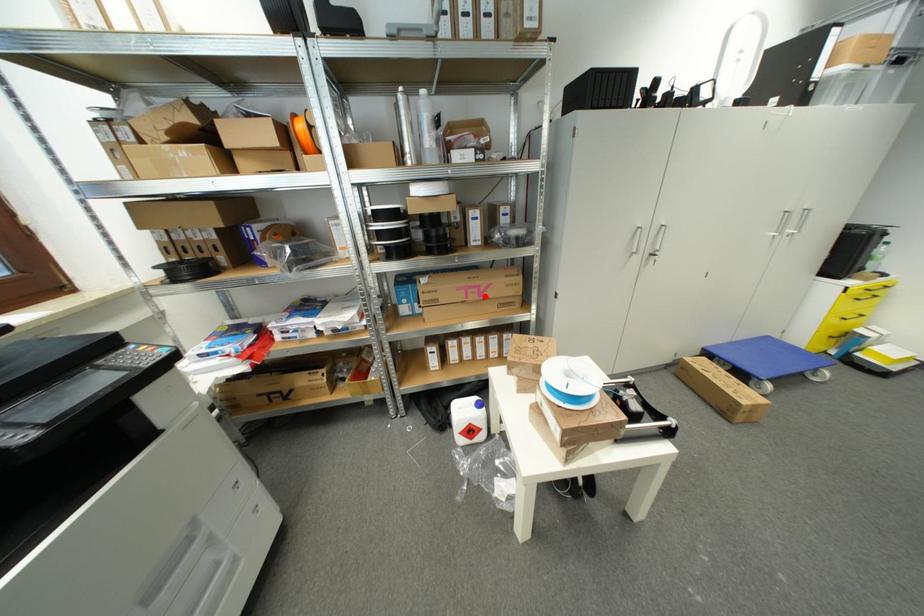
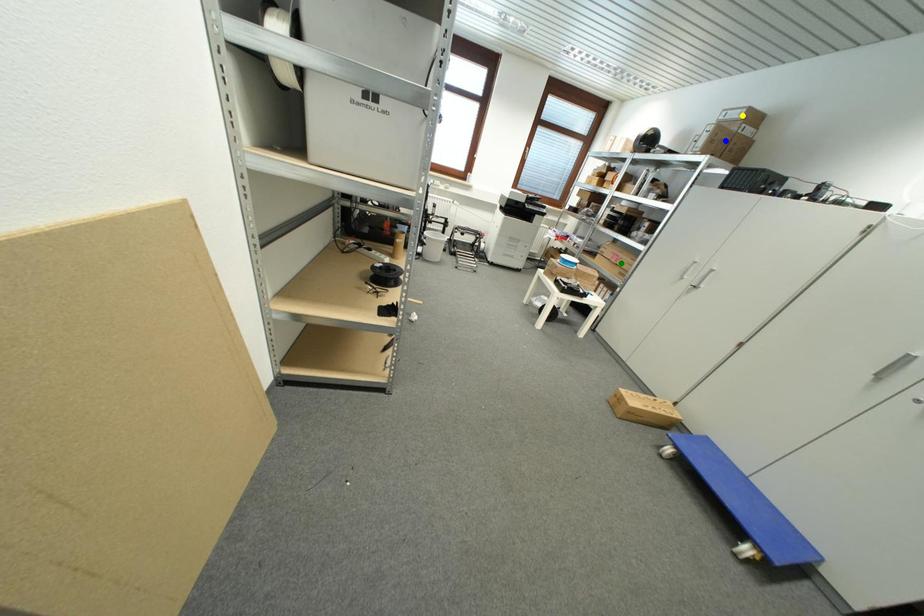
Question: I am providing you with two images of the same scene from different viewpoints. A red point is marked on the first image. You are given multiple points on the second image. In image 2, which mark is for the same physical point as the one in image 1?

Choices:
 (A) yellow point
 (B) blue point
 (C) green point

Answer: (C)